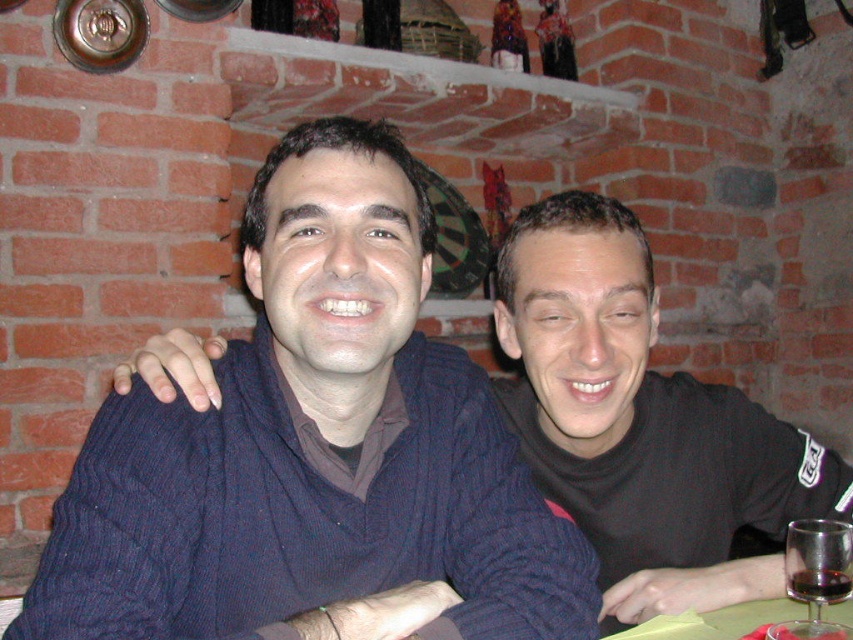
Between cable-knit sweater at center and dark red liquid at lower right, which one appears on the right side from the viewer's perspective?

From the viewer's perspective, dark red liquid at lower right appears more on the right side.

Can you confirm if cable-knit sweater at center is positioned to the left of dark red liquid at lower right?

Correct, you'll find cable-knit sweater at center to the left of dark red liquid at lower right.

Which is behind, point (520, 433) or point (837, 579)?

The point (520, 433) is behind.

This screenshot has width=853, height=640. What are the coordinates of `cable-knit sweater at center` in the screenshot? It's located at point(642,420).

Does cable-knit sweater at center appear on the right side of smooth glass table at lower right?

No, cable-knit sweater at center is not to the right of smooth glass table at lower right.

Which is above, cable-knit sweater at center or smooth glass table at lower right?

cable-knit sweater at center is higher up.

Measure the distance between cable-knit sweater at center and camera.

37.26 inches

Locate an element on the screen. cable-knit sweater at center is located at coordinates (642, 420).

Between transparent glass at lower right and dark red liquid at lower right, which one is positioned lower?

transparent glass at lower right is below.

Between point (834, 532) and point (846, 586), which one is positioned in front?

Positioned in front is point (846, 586).

Locate an element on the screen. transparent glass at lower right is located at coordinates coord(816,576).